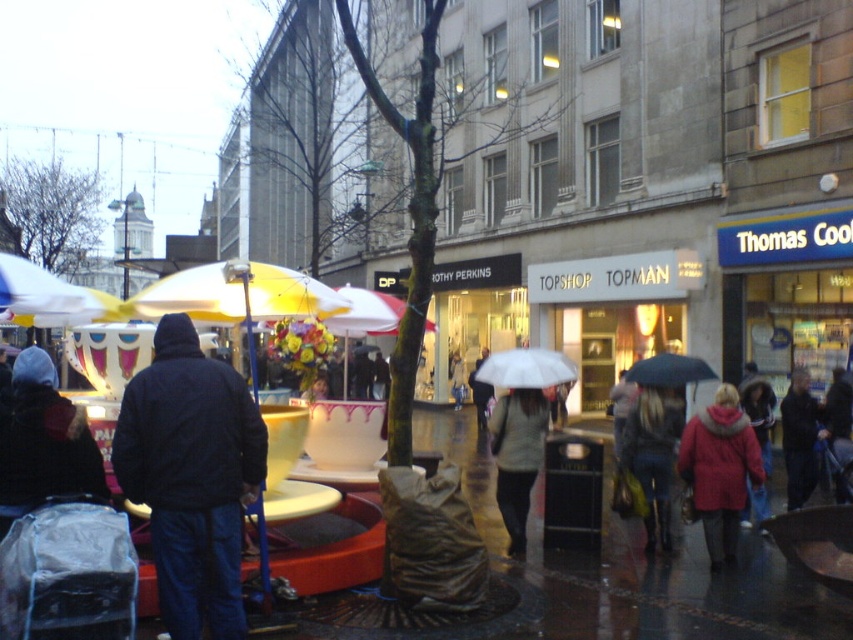
Which is behind, point (296, 289) or point (799, 502)?

Positioned behind is point (799, 502).

Based on the photo, who is more distant from viewer, (x=216, y=292) or (x=798, y=435)?

Positioned behind is point (x=798, y=435).

Identify the location of yellow matte umbrella at center. pos(236,294).

Measure the distance between yellow matte umbrella at center and matte black jacket at lower right.

yellow matte umbrella at center is 11.72 feet away from matte black jacket at lower right.

Does yellow matte umbrella at center appear under matte black jacket at lower right?

No, yellow matte umbrella at center is not below matte black jacket at lower right.

Is point (230, 317) positioned behind point (624, 444)?

No, it is in front of (624, 444).

This screenshot has height=640, width=853. I want to click on yellow matte umbrella at center, so click(x=236, y=294).

Is point (16, 445) positioned after point (811, 484)?

No, (16, 445) is closer to viewer.

Is dark blue jacket at left above dark blue jacket at center?

Yes.

Find the location of a particular element. The width and height of the screenshot is (853, 640). dark blue jacket at left is located at coordinates (44, 442).